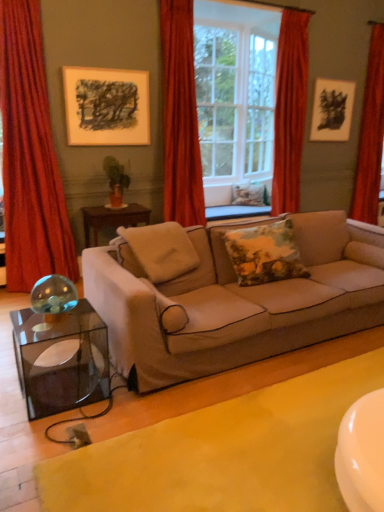
Question: Would you say matte black picture frame at upper left, which is the 2th picture frame from right to left, contains white glass window frame at center?

Choices:
 (A) yes
 (B) no

Answer: (B)

Question: From the image's perspective, would you say matte black picture frame at upper left, which is the second picture frame from back to front, is shown under white glass window frame at center?

Choices:
 (A) no
 (B) yes

Answer: (B)

Question: Considering the relative positions of matte black picture frame at upper left, which is the 2th picture frame from right to left, and white glass window frame at center in the image provided, is matte black picture frame at upper left, which is the 2th picture frame from right to left, behind white glass window frame at center?

Choices:
 (A) no
 (B) yes

Answer: (A)

Question: From the image's perspective, is matte black picture frame at upper left, placed as the first picture frame when sorted from left to right, over white glass window frame at center?

Choices:
 (A) no
 (B) yes

Answer: (A)

Question: Is matte black picture frame at upper left, placed as the first picture frame when sorted from left to right, completely or partially outside of white glass window frame at center?

Choices:
 (A) yes
 (B) no

Answer: (A)

Question: From a real-world perspective, does matte black picture frame at upper left, which is counted as the 1th picture frame, starting from the front, sit lower than white glass window frame at center?

Choices:
 (A) no
 (B) yes

Answer: (B)

Question: From the image's perspective, is velvet red curtain at center, the 2th curtain viewed from the left, over beige fabric couch at center?

Choices:
 (A) yes
 (B) no

Answer: (A)

Question: Does velvet red curtain at center, positioned as the third curtain in right-to-left order, have a lesser width compared to beige fabric couch at center?

Choices:
 (A) no
 (B) yes

Answer: (B)

Question: Is velvet red curtain at center, positioned as the third curtain in right-to-left order, not close to beige fabric couch at center?

Choices:
 (A) yes
 (B) no

Answer: (A)

Question: Is velvet red curtain at center, positioned as the third curtain in right-to-left order, not inside beige fabric couch at center?

Choices:
 (A) no
 (B) yes

Answer: (B)

Question: Is beige fabric couch at center inside velvet red curtain at center, the 2th curtain viewed from the left?

Choices:
 (A) yes
 (B) no

Answer: (B)

Question: Could you tell me if velvet red curtain at center, positioned as the third curtain in right-to-left order, is turned towards beige fabric couch at center?

Choices:
 (A) yes
 (B) no

Answer: (A)

Question: From a real-world perspective, is red velvet curtain at upper center, the third curtain viewed from the left, under beige fabric couch at center?

Choices:
 (A) no
 (B) yes

Answer: (A)